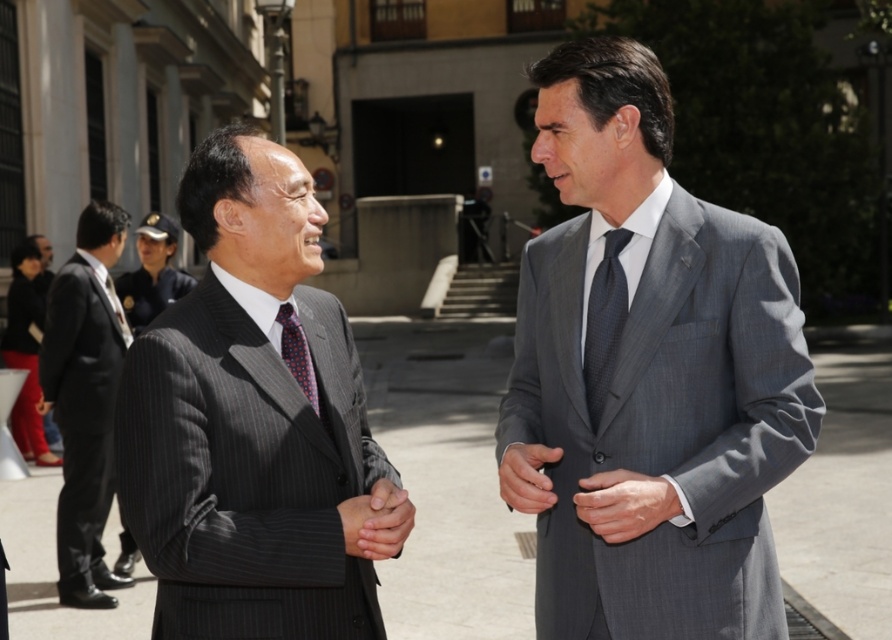
Question: Is gray pinstripe suit at right positioned at the back of dark gray textured tie at center?

Choices:
 (A) yes
 (B) no

Answer: (B)

Question: Can you confirm if gray pinstripe suit at right is wider than dark gray textured tie at center?

Choices:
 (A) yes
 (B) no

Answer: (A)

Question: Among these points, which one is nearest to the camera?

Choices:
 (A) (287, 307)
 (B) (120, 234)
 (C) (665, 513)
 (D) (113, 291)

Answer: (C)

Question: Which object is positioned closest to the dark gray pinstripe suit at center?

Choices:
 (A) polka dot silk tie at left
 (B) gray pinstripe suit at right
 (C) black pinstripe suit at left

Answer: (B)

Question: Which object is closer to the camera taking this photo?

Choices:
 (A) black pinstripe suit at left
 (B) dark gray textured tie at center
 (C) dark blue textured tie at left

Answer: (C)

Question: Does gray pinstripe suit at right appear on the left side of polka dot silk tie at left?

Choices:
 (A) yes
 (B) no

Answer: (B)